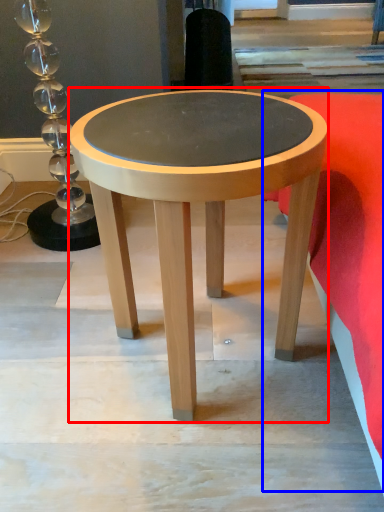
Question: Which object is closer to the camera taking this photo, coffee table (highlighted by a red box) or bedding (highlighted by a blue box)?

Choices:
 (A) coffee table
 (B) bedding

Answer: (B)